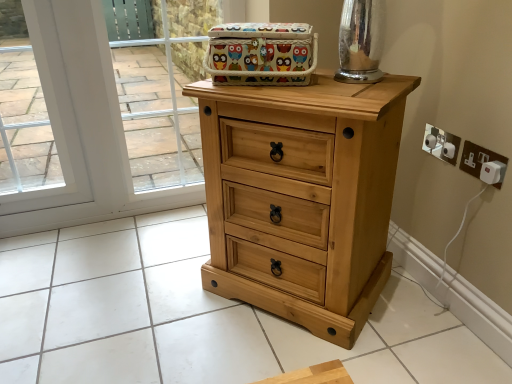
Question: Is brushed metal knob at center, which ranks as the first knob in front-to-back order, oriented away from transparent glass door at upper left?

Choices:
 (A) no
 (B) yes

Answer: (A)

Question: From a real-world perspective, does brushed metal knob at center, which ranks as the first knob in front-to-back order, stand above transparent glass door at upper left?

Choices:
 (A) no
 (B) yes

Answer: (B)

Question: Is brushed metal knob at center, which ranks as the first knob in front-to-back order, oriented towards transparent glass door at upper left?

Choices:
 (A) yes
 (B) no

Answer: (B)

Question: Is brushed metal knob at center, which ranks as the first knob in front-to-back order, outside transparent glass door at upper left?

Choices:
 (A) no
 (B) yes

Answer: (B)

Question: Is transparent glass door at upper left located within brushed metal knob at center, the 2th knob in the back-to-front sequence?

Choices:
 (A) yes
 (B) no

Answer: (B)

Question: From a real-world perspective, does brushed metal knob at center, the 2th knob in the back-to-front sequence, sit lower than transparent glass door at upper left?

Choices:
 (A) no
 (B) yes

Answer: (A)

Question: Does white plastic electric outlet at right, the 2th electric outlet viewed from the front, appear on the left side of brushed metal knob at upper right, which ranks as the second knob in front-to-back order?

Choices:
 (A) no
 (B) yes

Answer: (A)

Question: Would you consider white plastic electric outlet at right, the 2th electric outlet viewed from the front, to be distant from brushed metal knob at upper right, which appears as the first knob when viewed from the back?

Choices:
 (A) yes
 (B) no

Answer: (B)

Question: Is white plastic electric outlet at right, positioned as the first electric outlet in back-to-front order, next to brushed metal knob at upper right, which ranks as the second knob in front-to-back order?

Choices:
 (A) no
 (B) yes

Answer: (B)

Question: Can we say white plastic electric outlet at right, the 2th electric outlet viewed from the front, lies outside brushed metal knob at upper right, which ranks as the second knob in front-to-back order?

Choices:
 (A) no
 (B) yes

Answer: (B)

Question: Considering the relative positions of white plastic electric outlet at right, positioned as the first electric outlet in back-to-front order, and brushed metal knob at upper right, which ranks as the second knob in front-to-back order, in the image provided, is white plastic electric outlet at right, positioned as the first electric outlet in back-to-front order, to the right of brushed metal knob at upper right, which ranks as the second knob in front-to-back order, from the viewer's perspective?

Choices:
 (A) no
 (B) yes

Answer: (B)

Question: From a real-world perspective, is white plastic electric outlet at right, the 2th electric outlet viewed from the front, on brushed metal knob at upper right, which ranks as the second knob in front-to-back order?

Choices:
 (A) no
 (B) yes

Answer: (B)

Question: Is the position of white plastic electric outlet at right, the 2th electric outlet viewed from the front, more distant than that of brushed metal knob at center, which ranks as the first knob in front-to-back order?

Choices:
 (A) yes
 (B) no

Answer: (B)